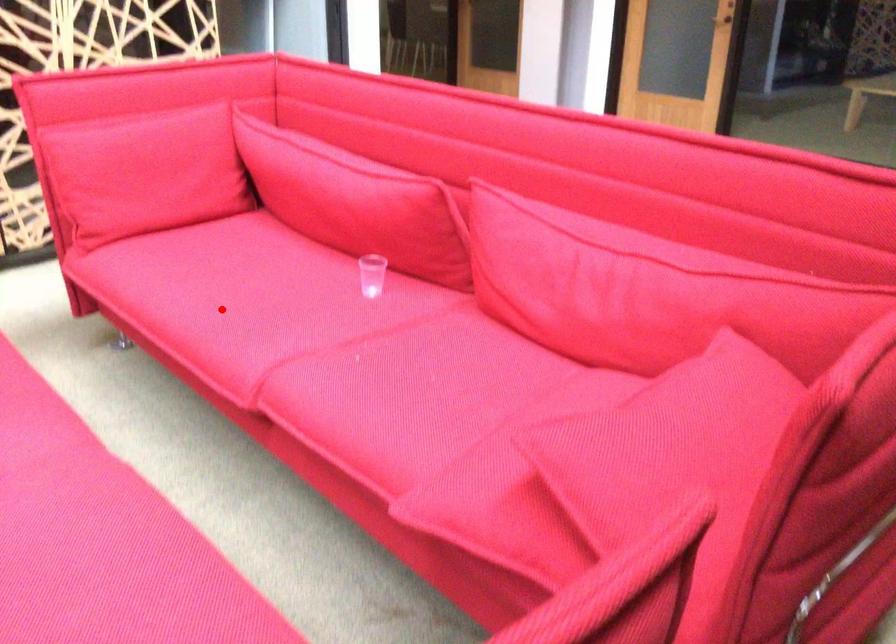
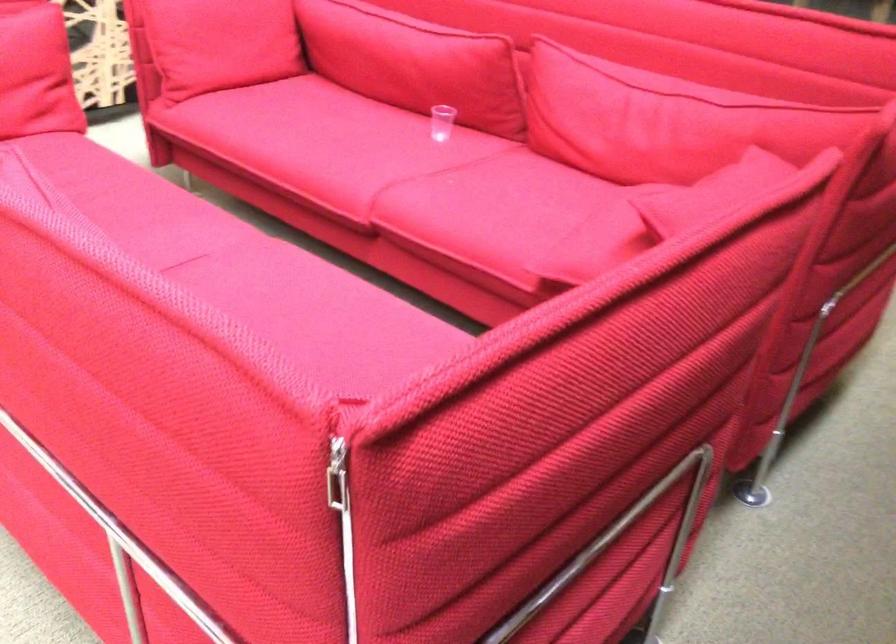
Question: I am providing you with two images of the same scene from different viewpoints. A red point is shown in image1. For the corresponding object point in image2, is it positioned nearer or farther from the camera?

Choices:
 (A) Nearer
 (B) Farther

Answer: (B)